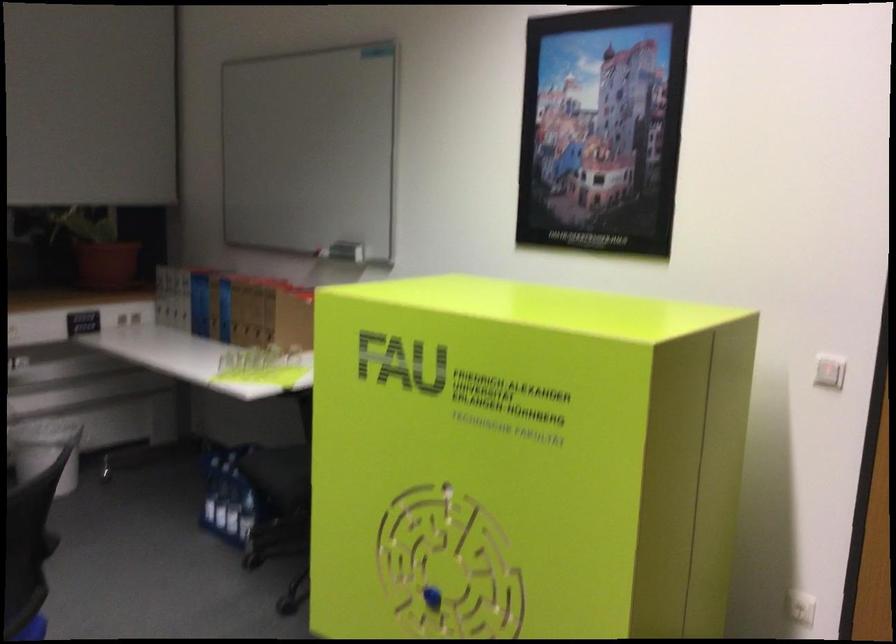
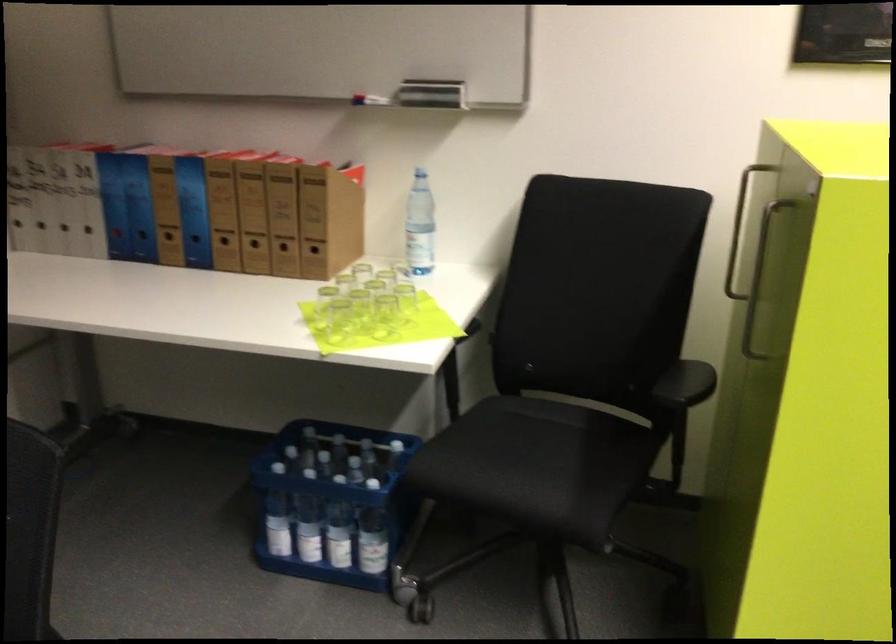
Locate, in the second image, the point that corresponds to [293,366] in the first image.

(405, 299)